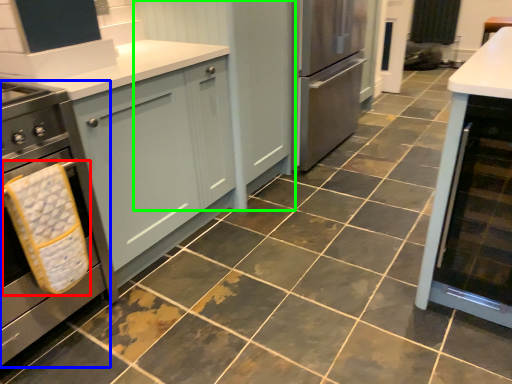
Question: Estimate the real-world distances between objects in this image. Which object is farther from material (highlighted by a red box), home appliance (highlighted by a blue box) or cabinetry (highlighted by a green box)?

Choices:
 (A) home appliance
 (B) cabinetry

Answer: (B)